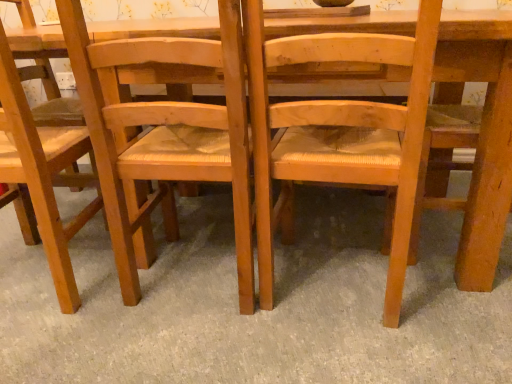
Locate an element on the screen. This screenshot has width=512, height=384. vacant space behind natural wood chair at center, which ranks as the first chair in right-to-left order is located at coordinates (330, 220).